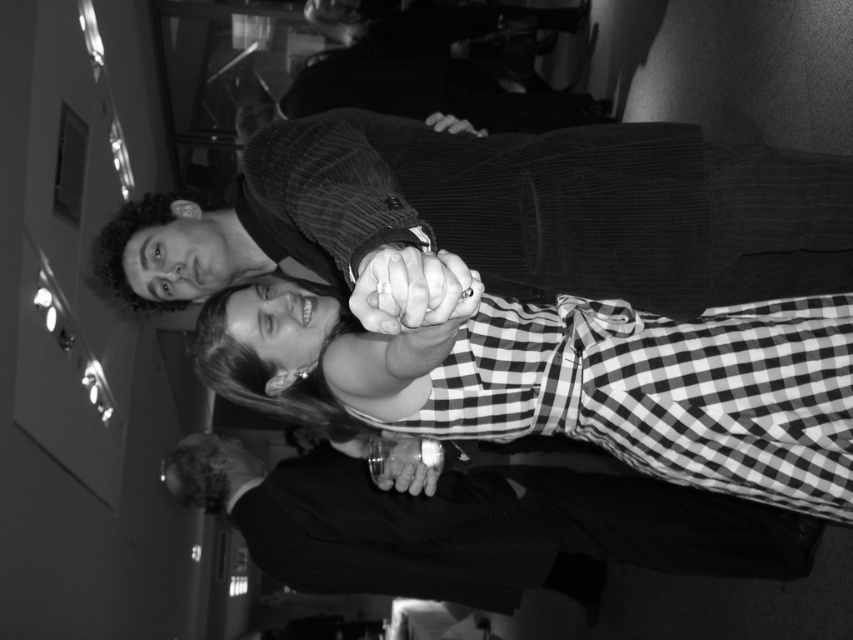
Question: Which object appears farthest from the camera in this image?

Choices:
 (A) checkered fabric dress at center
 (B) corduroy suit at center

Answer: (B)

Question: Observing the image, what is the correct spatial positioning of checkered fabric dress at center in reference to smooth black suit at lower center?

Choices:
 (A) above
 (B) below

Answer: (A)

Question: Which object appears closest to the camera in this image?

Choices:
 (A) checkered fabric dress at center
 (B) smooth black ring at center
 (C) corduroy suit at center

Answer: (B)

Question: Is corduroy suit at center bigger than checkered fabric dress at center?

Choices:
 (A) yes
 (B) no

Answer: (B)

Question: Among these points, which one is farthest from the camera?

Choices:
 (A) (471, 131)
 (B) (440, 412)
 (C) (421, 449)

Answer: (C)

Question: In this image, where is corduroy suit at center located relative to smooth black ring at center?

Choices:
 (A) right
 (B) left

Answer: (B)